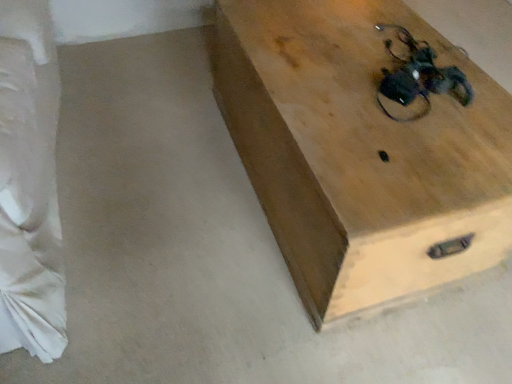
Question: Should I look upward or downward to see natural wood chest at upper right?

Choices:
 (A) up
 (B) down

Answer: (A)